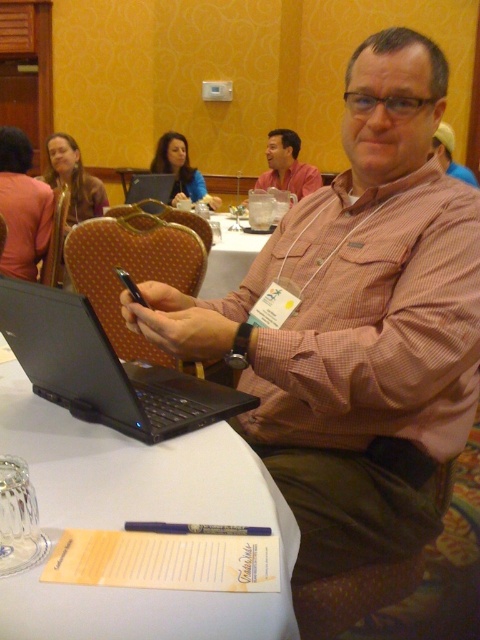
Does white paper at center appear under matte pink shirt at center?

Indeed, white paper at center is positioned under matte pink shirt at center.

Does white paper at center come in front of matte pink shirt at center?

Yes, it is in front of matte pink shirt at center.

Which is behind, point (288, 564) or point (280, 129)?

The point (280, 129) is behind.

Identify the location of white paper at center. (136, 518).

Can you confirm if matte pink shirt at upper left is shorter than matte brown jacket at upper left?

Yes, matte pink shirt at upper left is shorter than matte brown jacket at upper left.

Is matte pink shirt at upper left above matte brown jacket at upper left?

No.

Find the location of a particular element. matte pink shirt at upper left is located at coordinates (23, 208).

Does matte brown jacket at upper left have a smaller size compared to matte blue shirt at upper center?

No.

At what (x,y) coordinates should I click in order to perform the action: click on matte brown jacket at upper left. Please return your answer as a coordinate pair (x, y). This screenshot has height=640, width=480. Looking at the image, I should click on (73, 179).

Locate an element on the screen. matte brown jacket at upper left is located at coordinates (73, 179).